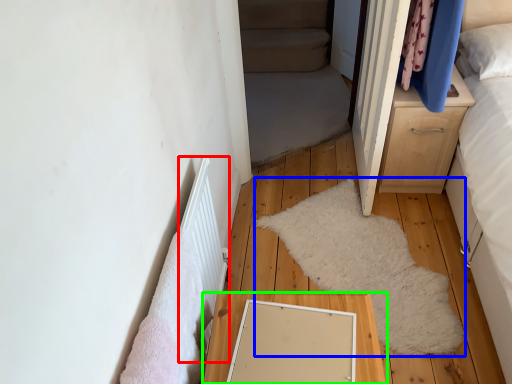
Question: Estimate the real-world distances between objects in this image. Which object is farther from radiator (highlighted by a red box), mat (highlighted by a blue box) or table (highlighted by a green box)?

Choices:
 (A) mat
 (B) table

Answer: (A)